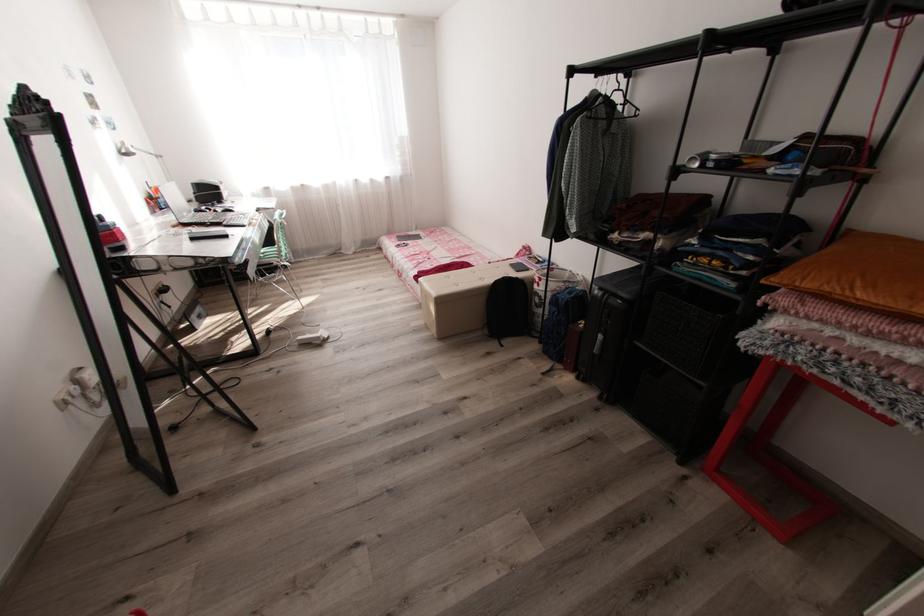
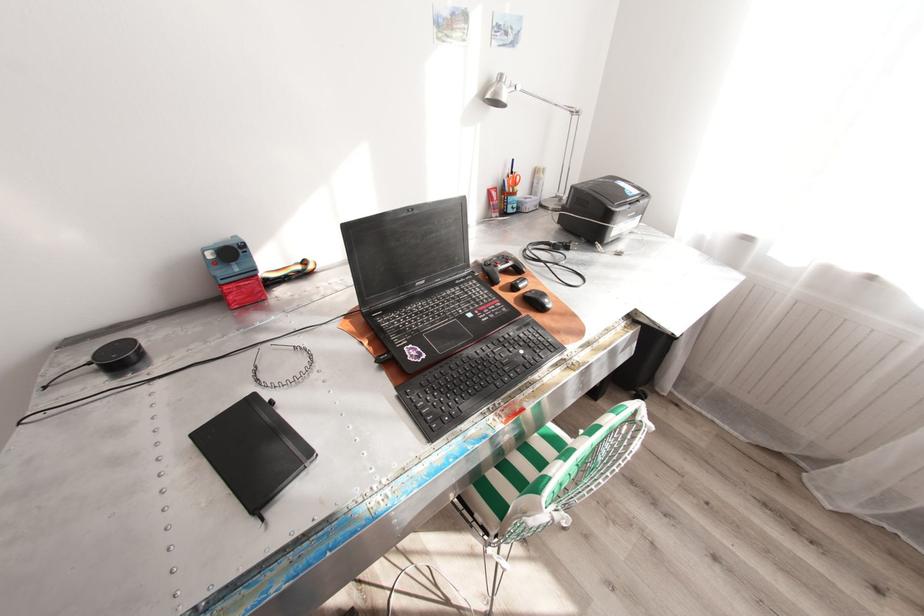
Where in the second image is the point corresponding to [237,211] from the first image?

(545, 308)